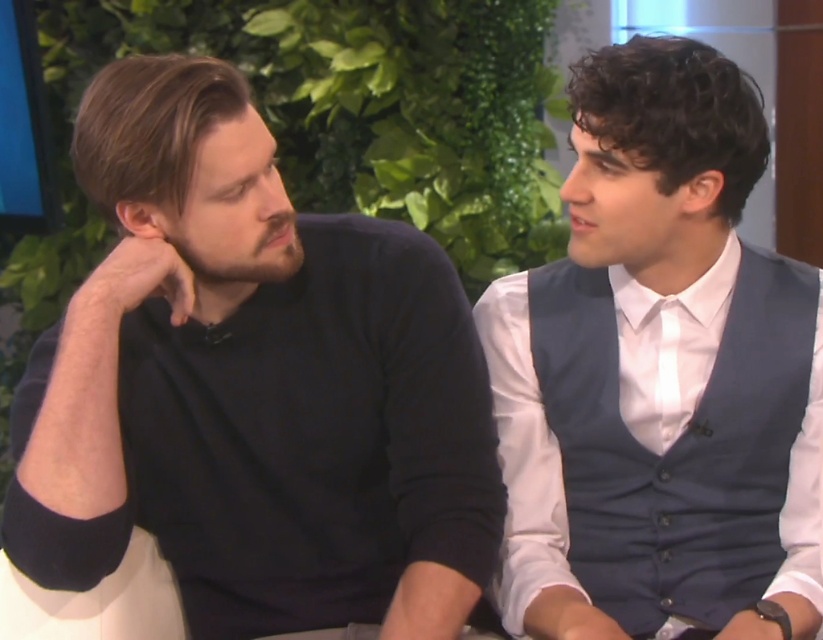
Which is more to the left, white shirt with navy blue vest at right or white satin tie at center?

white shirt with navy blue vest at right

Does white shirt with navy blue vest at right have a greater height compared to white satin tie at center?

Yes, white shirt with navy blue vest at right is taller than white satin tie at center.

You are a GUI agent. You are given a task and a screenshot of the screen. Output one action in this format:
    pyautogui.click(x=<x>, y=<y>)
    Task: Click on the white shirt with navy blue vest at right
    This screenshot has width=823, height=640.
    Given the screenshot: What is the action you would take?
    pyautogui.click(x=649, y=371)

Image resolution: width=823 pixels, height=640 pixels. I want to click on matte black sweater at left, so click(x=252, y=387).

Is matte black sweater at left thinner than white shirt with navy blue vest at right?

No, matte black sweater at left is not thinner than white shirt with navy blue vest at right.

Between point (222, 161) and point (819, 429), which one is positioned in front?

Point (222, 161) is in front.

The height and width of the screenshot is (640, 823). Identify the location of matte black sweater at left. (252, 387).

Does matte black sweater at left appear on the left side of white satin tie at center?

Yes, matte black sweater at left is to the left of white satin tie at center.

Measure the distance between point (384, 609) and camera.

1.27 meters

Where is `matte black sweater at left`? matte black sweater at left is located at coordinates (252, 387).